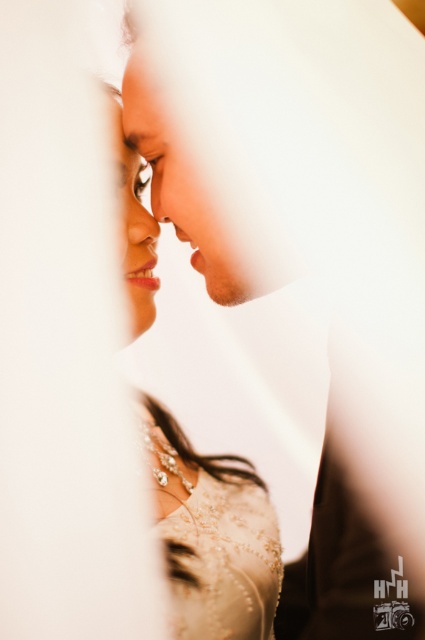
Question: Which of the following is the closest to the observer?

Choices:
 (A) (246, 556)
 (B) (238, 563)
 (C) (195, 179)

Answer: (C)

Question: Does ivory satin dress at center come behind ivory beaded dress at center?

Choices:
 (A) yes
 (B) no

Answer: (A)

Question: Which object is the farthest from the smooth skin man at center?

Choices:
 (A) ivory satin dress at center
 (B) ivory beaded dress at center

Answer: (B)

Question: Is ivory satin dress at center to the left of smooth skin man at center from the viewer's perspective?

Choices:
 (A) yes
 (B) no

Answer: (A)

Question: Which object is positioned farthest from the ivory satin dress at center?

Choices:
 (A) ivory beaded dress at center
 (B) smooth skin man at center

Answer: (B)

Question: In this image, where is ivory satin dress at center located relative to ivory beaded dress at center?

Choices:
 (A) right
 (B) left

Answer: (B)